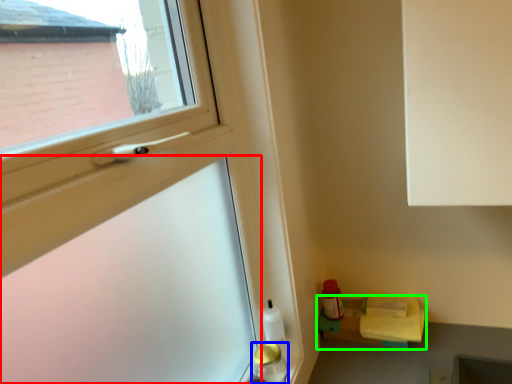
Question: Which object is positioned closest to screen door (highlighted by a red box)? Select from bottle (highlighted by a blue box) and shelf (highlighted by a green box).

Choices:
 (A) bottle
 (B) shelf

Answer: (A)